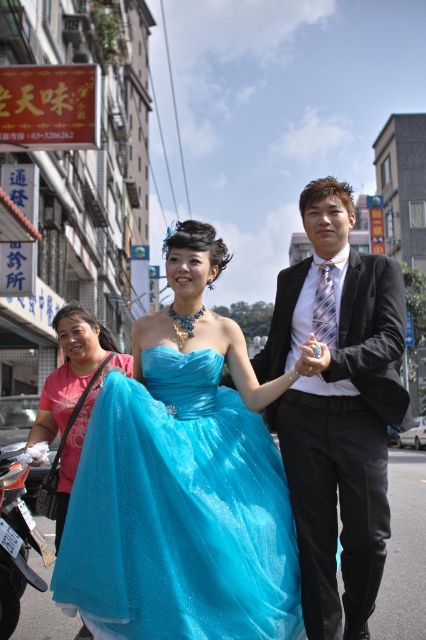
Can you confirm if turquoise satin dress at center is shorter than black satin suit at center?

Incorrect, turquoise satin dress at center's height does not fall short of black satin suit at center's.

Which is more to the right, turquoise satin dress at center or black satin suit at center?

black satin suit at center

Measure the distance between point (301, 541) and camera.

The distance of point (301, 541) from camera is 111.02 feet.

This screenshot has width=426, height=640. What are the coordinates of `turquoise satin dress at center` in the screenshot? It's located at (336, 406).

Between shiny tulle dress at center and shiny blue dress at center, which one appears on the right side from the viewer's perspective?

From the viewer's perspective, shiny tulle dress at center appears more on the right side.

Does shiny tulle dress at center have a lesser height compared to shiny blue dress at center?

Correct, shiny tulle dress at center is not as tall as shiny blue dress at center.

Is point (170, 518) positioned behind point (78, 420)?

No, (170, 518) is closer to viewer.

The height and width of the screenshot is (640, 426). I want to click on shiny tulle dress at center, so click(178, 513).

Is black satin suit at center positioned at the back of shiny blue dress at center?

No, black satin suit at center is closer to the viewer.

Who is more forward, (x=385, y=525) or (x=46, y=412)?

Point (x=385, y=525)

The height and width of the screenshot is (640, 426). What are the coordinates of `black satin suit at center` in the screenshot? It's located at (336, 406).